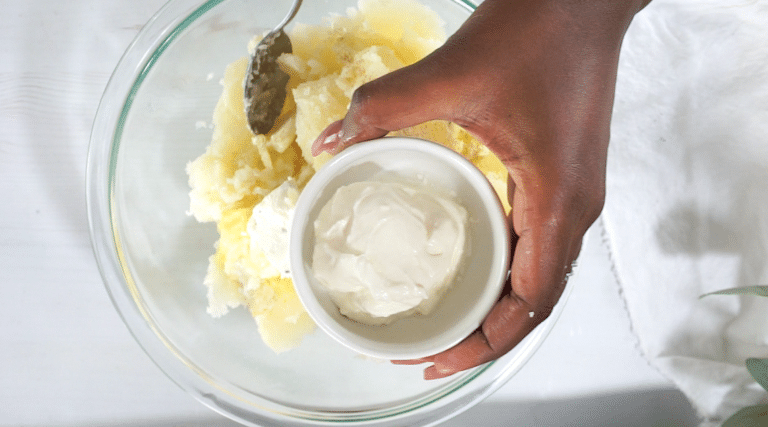
Where is `tablecloth`? This screenshot has height=427, width=768. tablecloth is located at coordinates (65, 251).